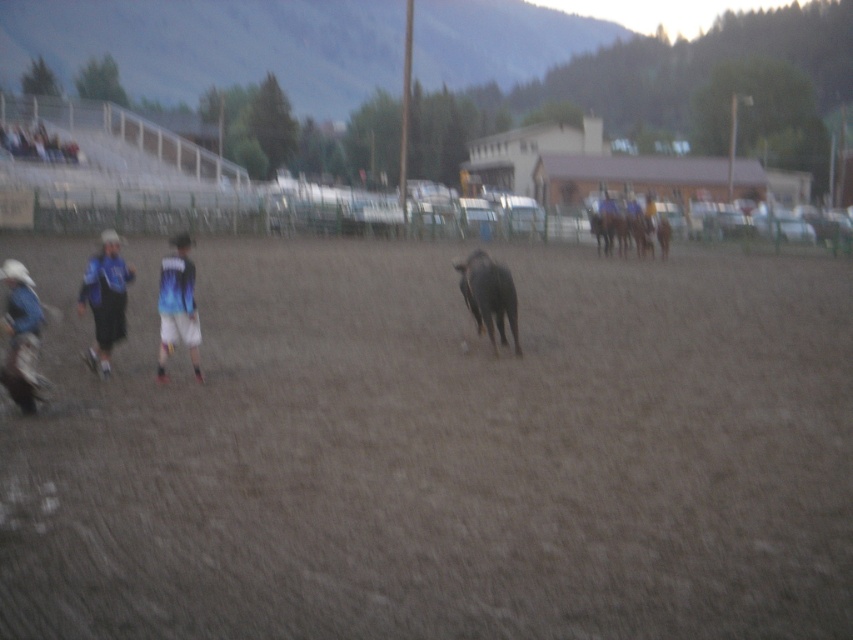
Can you confirm if blue gradient jersey at center is positioned to the left of black matte bull at center?

Indeed, blue gradient jersey at center is positioned on the left side of black matte bull at center.

Does point (187, 234) come closer to viewer compared to point (498, 300)?

No, (187, 234) is behind (498, 300).

This screenshot has height=640, width=853. What do you see at coordinates (177, 307) in the screenshot?
I see `blue gradient jersey at center` at bounding box center [177, 307].

Locate an element on the screen. Image resolution: width=853 pixels, height=640 pixels. blue gradient jersey at center is located at coordinates (177, 307).

Consider the image. Does brown sandy dirt at center lie in front of blue gradient jersey at center?

Yes, brown sandy dirt at center is closer to the viewer.

Between point (171, 636) and point (181, 248), which one is positioned behind?

The point (181, 248) is more distant.

Between point (415, 524) and point (175, 250), which one is positioned behind?

Positioned behind is point (175, 250).

Find the location of a particular element. This screenshot has height=640, width=853. brown sandy dirt at center is located at coordinates 445,452.

Between brown sandy dirt at center and black matte bull at center, which one appears on the right side from the viewer's perspective?

black matte bull at center is more to the right.

Is brown sandy dirt at center above black matte bull at center?

Indeed, brown sandy dirt at center is positioned over black matte bull at center.

The height and width of the screenshot is (640, 853). What do you see at coordinates (445, 452) in the screenshot?
I see `brown sandy dirt at center` at bounding box center [445, 452].

You are a GUI agent. You are given a task and a screenshot of the screen. Output one action in this format:
    pyautogui.click(x=<x>, y=<y>)
    Task: Click on the brown sandy dirt at center
    This screenshot has width=853, height=640.
    Given the screenshot: What is the action you would take?
    pyautogui.click(x=445, y=452)